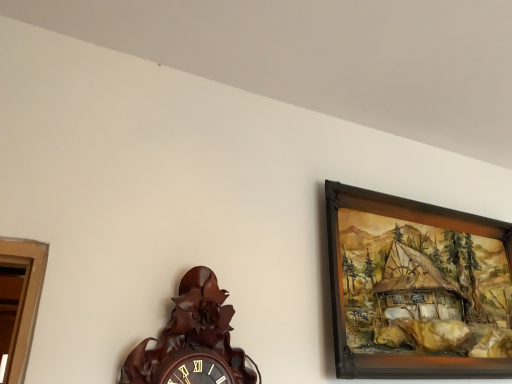
What is the approximate width of brown wooden wall clock at lower left?

brown wooden wall clock at lower left is 3.74 inches in width.

Image resolution: width=512 pixels, height=384 pixels. Describe the element at coordinates (193, 341) in the screenshot. I see `brown wooden wall clock at lower left` at that location.

Image resolution: width=512 pixels, height=384 pixels. Find the location of `brown wooden wall clock at lower left`. brown wooden wall clock at lower left is located at coordinates (193, 341).

This screenshot has width=512, height=384. What are the coordinates of `wooden picture frame at upper right` in the screenshot? It's located at (417, 288).

Measure the distance between point (440, 323) and camera.

The depth of point (440, 323) is 1.26 meters.

The image size is (512, 384). What do you see at coordinates (417, 288) in the screenshot? I see `wooden picture frame at upper right` at bounding box center [417, 288].

Find the location of `brown wooden wall clock at lower left`. brown wooden wall clock at lower left is located at coordinates (193, 341).

Which object is positioned more to the left, wooden picture frame at upper right or brown wooden wall clock at lower left?

From the viewer's perspective, brown wooden wall clock at lower left appears more on the left side.

In the scene shown: Is wooden picture frame at upper right positioned before brown wooden wall clock at lower left?

No, wooden picture frame at upper right is further to the viewer.

Which is nearer, (385, 213) or (182, 309)?

Clearly, point (385, 213) is more distant from the camera than point (182, 309).

From the image's perspective, which is below, wooden picture frame at upper right or brown wooden wall clock at lower left?

brown wooden wall clock at lower left, from the image's perspective.

From a real-world perspective, is wooden picture frame at upper right positioned above or below brown wooden wall clock at lower left?

Clearly, from a real-world perspective, wooden picture frame at upper right is above brown wooden wall clock at lower left.

Between wooden picture frame at upper right and brown wooden wall clock at lower left, which one has larger width?

Wider between the two is brown wooden wall clock at lower left.

Looking at this image, from their relative heights in the image, would you say wooden picture frame at upper right is taller or shorter than brown wooden wall clock at lower left?

In the image, wooden picture frame at upper right appears to be taller than brown wooden wall clock at lower left.

Who is bigger, wooden picture frame at upper right or brown wooden wall clock at lower left?

wooden picture frame at upper right is bigger.

Based on the photo, is wooden picture frame at upper right positioned beyond the bounds of brown wooden wall clock at lower left?

Yes, wooden picture frame at upper right is not within brown wooden wall clock at lower left.

Is wooden picture frame at upper right next to brown wooden wall clock at lower left and touching it?

No, wooden picture frame at upper right is not next to brown wooden wall clock at lower left.

Is wooden picture frame at upper right positioned with its back to brown wooden wall clock at lower left?

That's not correct — wooden picture frame at upper right is not looking away from brown wooden wall clock at lower left.

Locate an element on the screen. The height and width of the screenshot is (384, 512). wall clock that appears below the wooden picture frame at upper right (from the image's perspective) is located at coordinates (193, 341).

Between brown wooden wall clock at lower left and wooden picture frame at upper right, which one appears on the left side from the viewer's perspective?

Positioned to the left is brown wooden wall clock at lower left.

Is the depth of brown wooden wall clock at lower left less than that of wooden picture frame at upper right?

Yes, it is.

Between point (143, 351) and point (403, 376), which one is positioned in front?

The point (143, 351) is in front.

From the image's perspective, is brown wooden wall clock at lower left located above or below wooden picture frame at upper right?

brown wooden wall clock at lower left is below wooden picture frame at upper right.

From a real-world perspective, is brown wooden wall clock at lower left on top of wooden picture frame at upper right?

No, from a real-world perspective, brown wooden wall clock at lower left is not over wooden picture frame at upper right

Which of these two, brown wooden wall clock at lower left or wooden picture frame at upper right, is thinner?

wooden picture frame at upper right.

Considering the sizes of objects brown wooden wall clock at lower left and wooden picture frame at upper right in the image provided, who is shorter, brown wooden wall clock at lower left or wooden picture frame at upper right?

brown wooden wall clock at lower left is shorter.

Can you confirm if brown wooden wall clock at lower left is smaller than wooden picture frame at upper right?

Yes.

Is brown wooden wall clock at lower left inside or outside of wooden picture frame at upper right?

brown wooden wall clock at lower left is not inside wooden picture frame at upper right, it's outside.

Are brown wooden wall clock at lower left and wooden picture frame at upper right far apart?

No, brown wooden wall clock at lower left is not far from wooden picture frame at upper right.

Is brown wooden wall clock at lower left oriented away from wooden picture frame at upper right?

That's not correct — brown wooden wall clock at lower left is not looking away from wooden picture frame at upper right.

The width and height of the screenshot is (512, 384). I want to click on wall clock that appears in front of the wooden picture frame at upper right, so click(x=193, y=341).

At what (x,y) coordinates should I click in order to perform the action: click on wall clock below the wooden picture frame at upper right (from the image's perspective). Please return your answer as a coordinate pair (x, y). The width and height of the screenshot is (512, 384). Looking at the image, I should click on (193, 341).

This screenshot has width=512, height=384. What are the coordinates of `picture frame on the right of brown wooden wall clock at lower left` in the screenshot? It's located at (417, 288).